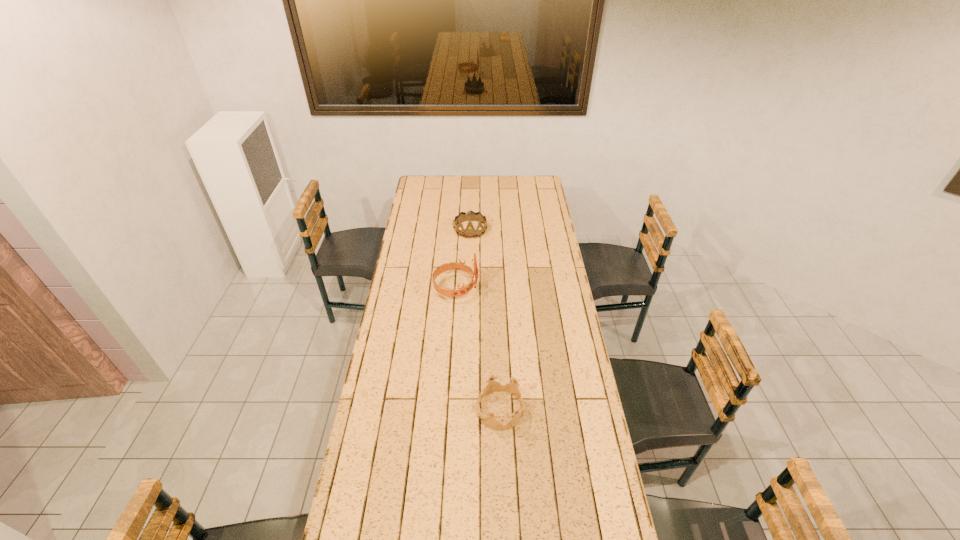
Where is `vacant area that lies between the tallest tiara and the second tallest tiara`? The height and width of the screenshot is (540, 960). vacant area that lies between the tallest tiara and the second tallest tiara is located at coordinates coord(464,259).

This screenshot has height=540, width=960. Identify the location of free space between the second nearest tiara and the second tallest object. (464, 259).

Image resolution: width=960 pixels, height=540 pixels. What are the coordinates of `the closest object to the tallest object` in the screenshot? It's located at (469, 232).

Where is `the second closest object relative to the nearest object`? The width and height of the screenshot is (960, 540). the second closest object relative to the nearest object is located at coordinates (469, 232).

The height and width of the screenshot is (540, 960). I want to click on tiara that is the nearest to the second shortest object, so click(x=462, y=290).

Identify which tiara is located as the second nearest to the nearest object. Please provide its 2D coordinates. Your answer should be formatted as a tuple, i.e. [(x, y)], where the tuple contains the x and y coordinates of a point satisfying the conditions above.

[(469, 232)]

This screenshot has height=540, width=960. In order to click on vacant region that satisfies the following two spatial constraints: 1. at the front of the second shortest object with jewels; 2. on the front-facing side of the second nearest tiara in this screenshot , I will do `click(468, 288)`.

In order to click on vacant space that satisfies the following two spatial constraints: 1. at the front of the second tallest tiara with jewels; 2. on the front-facing side of the tallest tiara in this screenshot , I will do pos(468,288).